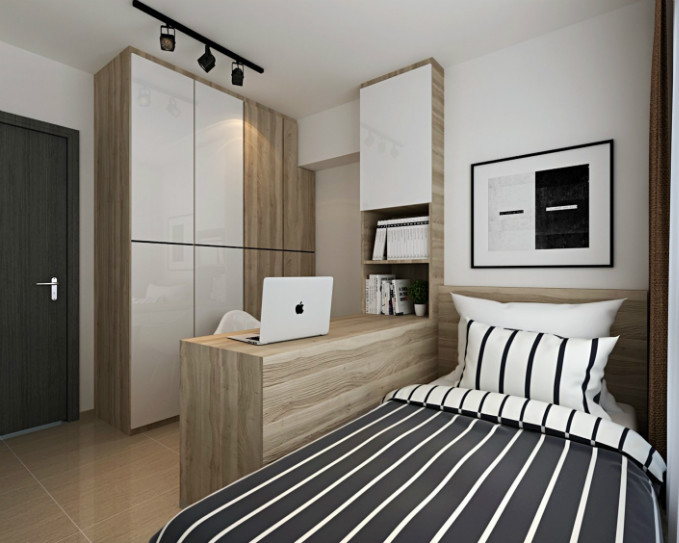
Find the location of a particular element. door is located at coordinates (33, 233).